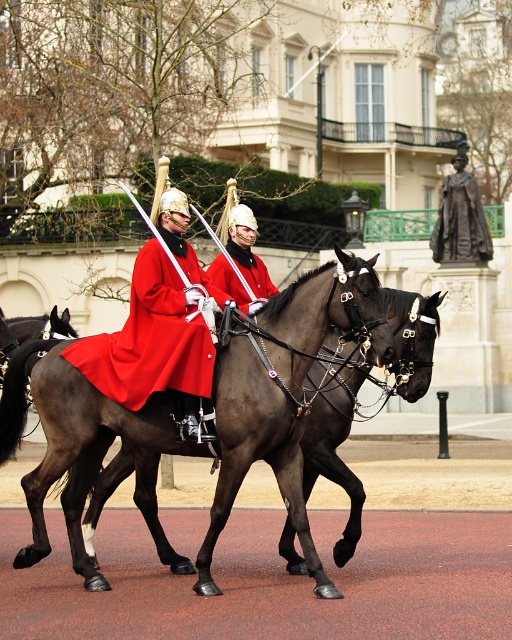
Based on the photo, you are a photographer standing in front of the mounted guards. You want to take a photo that includes both the shiny dark brown horse at center and the matte red coat at center. Based on their positions, which object should appear to the right side in your photo?

The shiny dark brown horse at center is positioned to the right of the matte red coat at center, so in the photo, the shiny dark brown horse at center will appear on the right side.

You are a tailor observing two guards in the scene. Both guards are wearing coats described as matte red coat at center and shiny red coat at center. Which coat is shorter?

The matte red coat at center is shorter than the shiny red coat at center.

You are observing two guards in the scene. One is wearing a matte red coat at center and the other a shiny red coat at center. From your perspective, which coat is located to the right?

The shiny red coat at center is located to the right of the matte red coat at center.